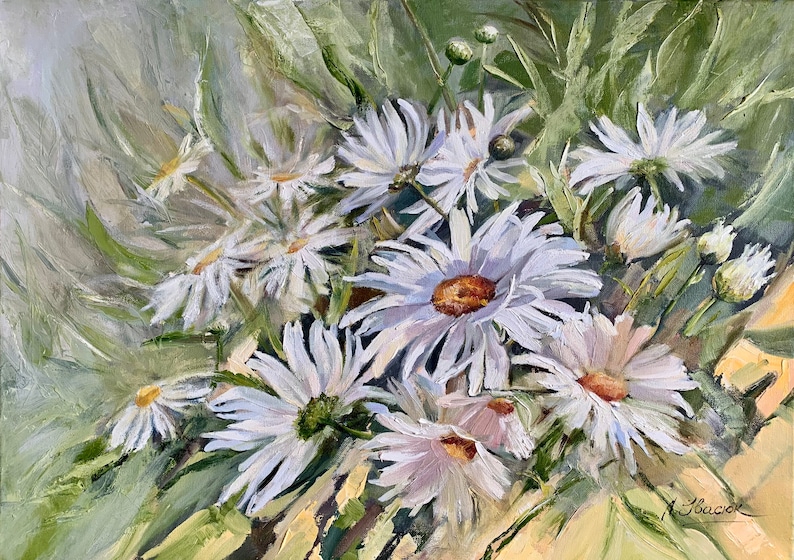
The height and width of the screenshot is (560, 794). Find the location of `upper right corner of painting`. upper right corner of painting is located at coordinates (789, 3).